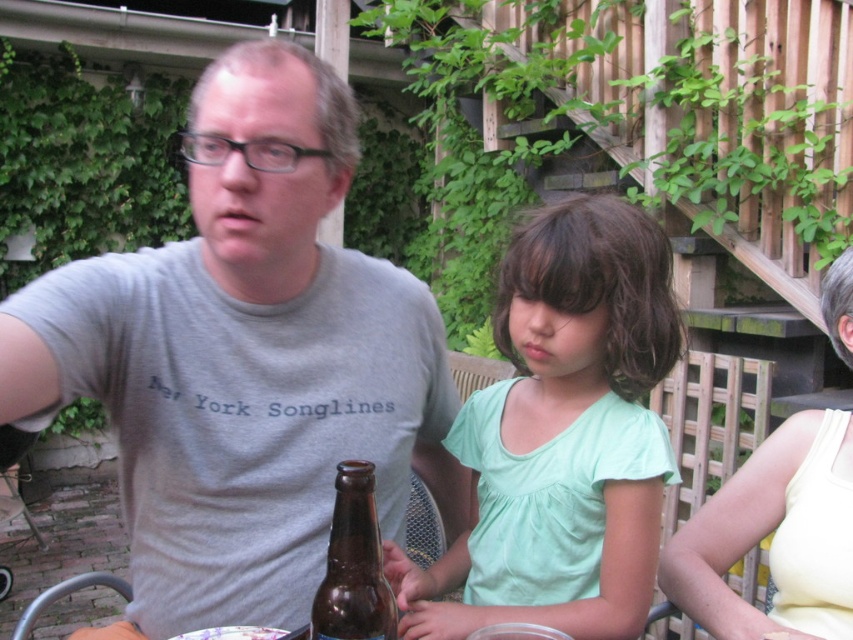
Question: Which of the following is the farthest from the observer?

Choices:
 (A) light green fabric shirt at center
 (B) brown glass bottle at center
 (C) gray cotton shirt at upper left
 (D) yellow fabric tank top at right

Answer: (D)

Question: Can you confirm if gray cotton shirt at upper left is wider than light green fabric shirt at center?

Choices:
 (A) yes
 (B) no

Answer: (A)

Question: Is gray cotton shirt at upper left below yellow fabric tank top at right?

Choices:
 (A) yes
 (B) no

Answer: (B)

Question: Which point is closer to the camera?

Choices:
 (A) gray cotton shirt at upper left
 (B) light green fabric shirt at center
 (C) brown glass bottle at center

Answer: (C)

Question: Is gray cotton shirt at upper left behind light green fabric shirt at center?

Choices:
 (A) no
 (B) yes

Answer: (A)

Question: Which point is closer to the camera?

Choices:
 (A) (495, 420)
 (B) (437, 323)
 (C) (706, 608)
 (D) (374, 538)

Answer: (D)